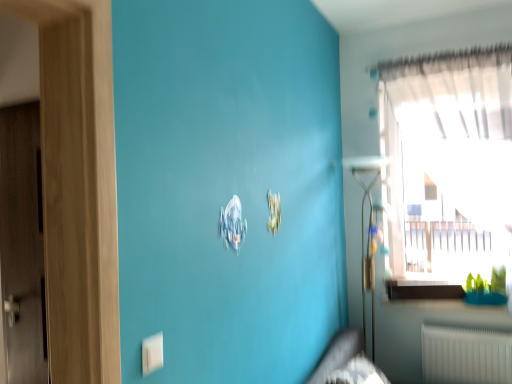
Question: Is transparent glass window at upper right to the left of white plastic electric outlet at lower left from the viewer's perspective?

Choices:
 (A) no
 (B) yes

Answer: (A)

Question: From the image's perspective, is transparent glass window at upper right on white plastic electric outlet at lower left?

Choices:
 (A) yes
 (B) no

Answer: (A)

Question: Is white plastic electric outlet at lower left located within transparent glass window at upper right?

Choices:
 (A) yes
 (B) no

Answer: (B)

Question: Is transparent glass window at upper right behind white plastic electric outlet at lower left?

Choices:
 (A) no
 (B) yes

Answer: (B)

Question: Does transparent glass window at upper right have a greater width compared to white plastic electric outlet at lower left?

Choices:
 (A) no
 (B) yes

Answer: (B)

Question: From a real-world perspective, is transparent glass window at upper right below white plastic electric outlet at lower left?

Choices:
 (A) no
 (B) yes

Answer: (A)

Question: Is white plastic electric outlet at lower left facing away from transparent glass window at upper right?

Choices:
 (A) no
 (B) yes

Answer: (A)

Question: Does white plastic electric outlet at lower left have a greater height compared to transparent glass window at upper right?

Choices:
 (A) no
 (B) yes

Answer: (A)

Question: Is white plastic electric outlet at lower left smaller than transparent glass window at upper right?

Choices:
 (A) yes
 (B) no

Answer: (A)

Question: From a real-world perspective, does white plastic electric outlet at lower left sit lower than transparent glass window at upper right?

Choices:
 (A) yes
 (B) no

Answer: (A)

Question: Does white plastic electric outlet at lower left come behind transparent glass window at upper right?

Choices:
 (A) no
 (B) yes

Answer: (A)

Question: From a real-world perspective, is white plastic electric outlet at lower left positioned over transparent glass window at upper right based on gravity?

Choices:
 (A) yes
 (B) no

Answer: (B)

Question: Considering the relative sizes of white plastic electric outlet at lower left and white glossy window sill at lower right in the image provided, is white plastic electric outlet at lower left wider than white glossy window sill at lower right?

Choices:
 (A) yes
 (B) no

Answer: (B)